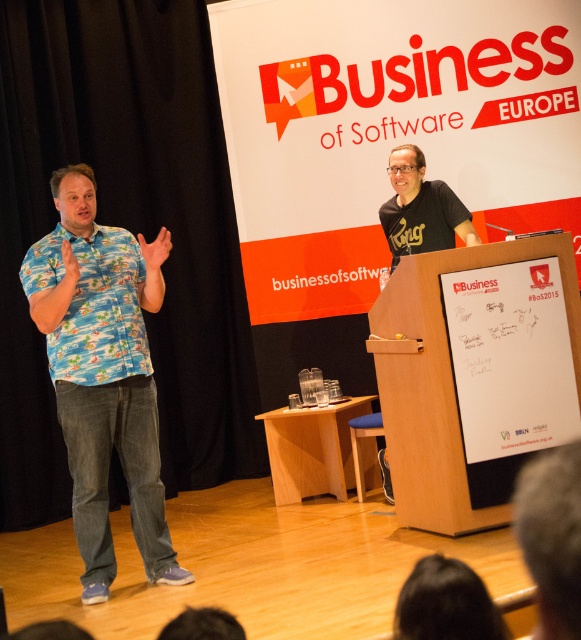
Who is positioned more to the left, black matte podium at center or light wood podium at center?

light wood podium at center is more to the left.

Is black matte podium at center positioned behind light wood podium at center?

That is True.

Where is `black matte podium at center`? This screenshot has width=581, height=640. black matte podium at center is located at coordinates (389, 131).

Where is `black matte podium at center`? Image resolution: width=581 pixels, height=640 pixels. black matte podium at center is located at coordinates (389, 131).

Between dark hair at lower center and black matte t-shirt at upper right, which one appears on the left side from the viewer's perspective?

From the viewer's perspective, dark hair at lower center appears more on the left side.

Is point (446, 577) positioned after point (399, 150)?

No.

Where is `dark hair at lower center`? The width and height of the screenshot is (581, 640). dark hair at lower center is located at coordinates (446, 604).

How far apart are blue printed shirt at left and dark hair at lower center?

A distance of 2.79 meters exists between blue printed shirt at left and dark hair at lower center.

Between blue printed shirt at left and dark hair at lower center, which one has more height?

blue printed shirt at left

Locate an element on the screen. blue printed shirt at left is located at coordinates (92, 305).

Find the location of a particular element. Image resolution: width=581 pixels, height=640 pixels. blue printed shirt at left is located at coordinates (92, 305).